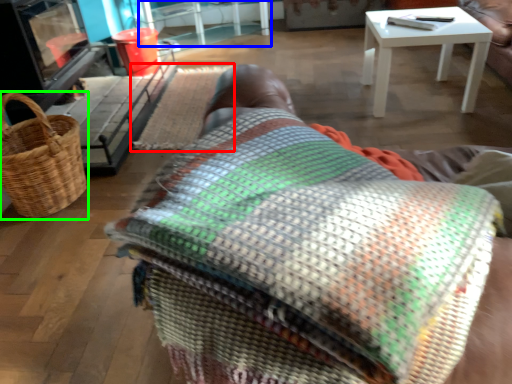
Question: Which is farther away from mat (highlighted by a red box)? table (highlighted by a blue box) or picnic basket (highlighted by a green box)?

Choices:
 (A) table
 (B) picnic basket

Answer: (A)